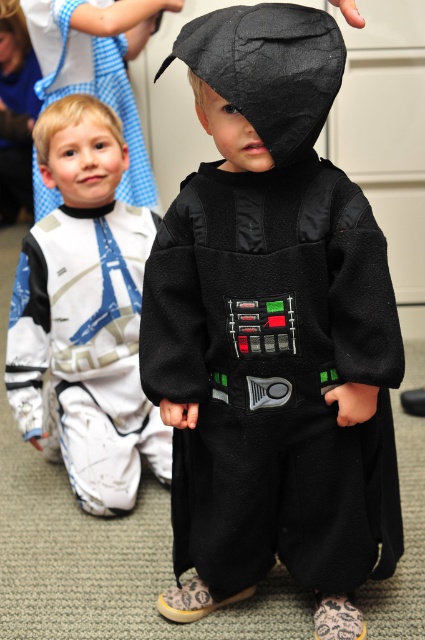
Question: Does felt black costume at center come behind matte black costume at center?

Choices:
 (A) no
 (B) yes

Answer: (A)

Question: Can you confirm if felt black costume at center is wider than matte black costume at center?

Choices:
 (A) yes
 (B) no

Answer: (A)

Question: Which is farther from the white fleece costume at upper left?

Choices:
 (A) felt black costume at center
 (B) matte black costume at center

Answer: (A)

Question: Which point appears closest to the camera in this image?

Choices:
 (A) (206, 564)
 (B) (124, 115)

Answer: (A)

Question: Does felt black costume at center appear on the right side of matte black costume at center?

Choices:
 (A) no
 (B) yes

Answer: (B)

Question: Which object appears closest to the camera in this image?

Choices:
 (A) matte black costume at center
 (B) white fleece costume at upper left
 (C) felt black costume at center

Answer: (C)